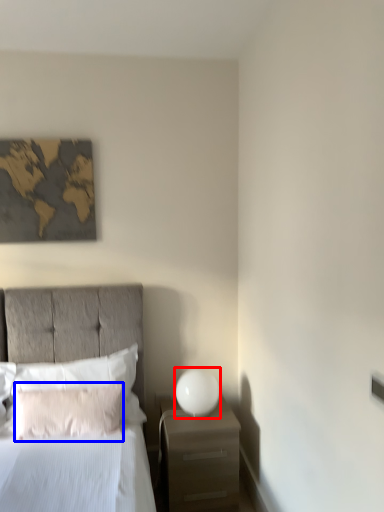
Question: Which point is further to the camera, bedside lamp (highlighted by a red box) or pillow (highlighted by a blue box)?

Choices:
 (A) bedside lamp
 (B) pillow

Answer: (A)